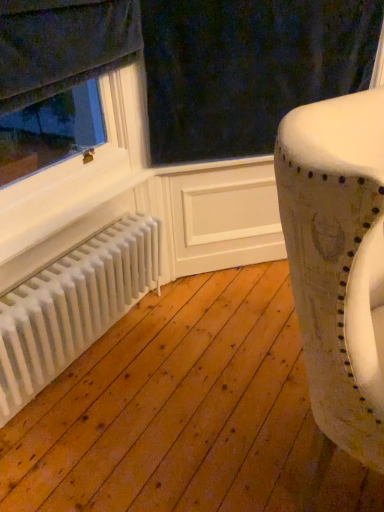
Describe the element at coordinates (73, 306) in the screenshot. I see `white matte radiator at lower left` at that location.

The width and height of the screenshot is (384, 512). What are the coordinates of `white matte radiator at lower left` in the screenshot? It's located at (73, 306).

What do you see at coordinates (338, 260) in the screenshot? This screenshot has height=512, width=384. I see `distressed leather chair at right` at bounding box center [338, 260].

Locate an element on the screen. distressed leather chair at right is located at coordinates (338, 260).

The image size is (384, 512). I want to click on white matte radiator at lower left, so click(73, 306).

Between distressed leather chair at right and white matte radiator at lower left, which one appears on the right side from the viewer's perspective?

Positioned to the right is distressed leather chair at right.

Which object is more forward, distressed leather chair at right or white matte radiator at lower left?

distressed leather chair at right is in front.

Considering the points (373, 397) and (73, 274), which point is behind, point (373, 397) or point (73, 274)?

The point (73, 274) is farther from the camera.

From the image's perspective, is distressed leather chair at right on top of white matte radiator at lower left?

Indeed, from the image's perspective, distressed leather chair at right is shown above white matte radiator at lower left.

From a real-world perspective, which is physically below, distressed leather chair at right or white matte radiator at lower left?

white matte radiator at lower left, from a real-world perspective.

Between distressed leather chair at right and white matte radiator at lower left, which one has smaller width?

white matte radiator at lower left.

Between distressed leather chair at right and white matte radiator at lower left, which one has more height?

distressed leather chair at right.

Considering the relative sizes of distressed leather chair at right and white matte radiator at lower left in the image provided, is distressed leather chair at right smaller than white matte radiator at lower left?

No.

Can we say distressed leather chair at right lies outside white matte radiator at lower left?

Yes.

Is distressed leather chair at right next to white matte radiator at lower left?

No, distressed leather chair at right is not beside white matte radiator at lower left.

Is distressed leather chair at right facing away from white matte radiator at lower left?

Yes, distressed leather chair at right is facing away from white matte radiator at lower left.

How many degrees apart are the facing directions of distressed leather chair at right and white matte radiator at lower left?

There is a 0.135-degree angle between the facing directions of distressed leather chair at right and white matte radiator at lower left.

The height and width of the screenshot is (512, 384). Find the location of `radiator lying below the distressed leather chair at right (from the image's perspective)`. radiator lying below the distressed leather chair at right (from the image's perspective) is located at coordinates (73, 306).

Considering the positions of objects white matte radiator at lower left and distressed leather chair at right in the image provided, who is more to the right, white matte radiator at lower left or distressed leather chair at right?

distressed leather chair at right is more to the right.

Which object is further away from the camera taking this photo, white matte radiator at lower left or distressed leather chair at right?

white matte radiator at lower left is more distant.

Is point (31, 321) behind point (317, 247)?

Yes, it is.

From the image's perspective, is white matte radiator at lower left located above distressed leather chair at right?

No.

From a real-world perspective, who is located lower, white matte radiator at lower left or distressed leather chair at right?

white matte radiator at lower left, from a real-world perspective.

Which of these two, white matte radiator at lower left or distressed leather chair at right, is wider?

Wider between the two is distressed leather chair at right.

Can you confirm if white matte radiator at lower left is shorter than distressed leather chair at right?

Indeed, white matte radiator at lower left has a lesser height compared to distressed leather chair at right.

Considering the sizes of objects white matte radiator at lower left and distressed leather chair at right in the image provided, who is bigger, white matte radiator at lower left or distressed leather chair at right?

distressed leather chair at right.

Looking at this image, is distressed leather chair at right a part of white matte radiator at lower left?

Actually, distressed leather chair at right is outside white matte radiator at lower left.

Is white matte radiator at lower left far from distressed leather chair at right?

Actually, white matte radiator at lower left and distressed leather chair at right are a little close together.

Is white matte radiator at lower left facing away from distressed leather chair at right?

No, white matte radiator at lower left's orientation is not away from distressed leather chair at right.

In the scene shown: Measure the distance between white matte radiator at lower left and distressed leather chair at right.

34.59 inches.

Locate an element on the screen. The image size is (384, 512). furniture that is on the right side of white matte radiator at lower left is located at coordinates (338, 260).

You are a GUI agent. You are given a task and a screenshot of the screen. Output one action in this format:
    pyautogui.click(x=<x>, y=<y>)
    Task: Click on the radiator on the left of distressed leather chair at right
    Image resolution: width=384 pixels, height=512 pixels.
    Given the screenshot: What is the action you would take?
    pyautogui.click(x=73, y=306)

You are a GUI agent. You are given a task and a screenshot of the screen. Output one action in this format:
    pyautogui.click(x=<x>, y=<y>)
    Task: Click on the furniture in front of the white matte radiator at lower left
    
    Given the screenshot: What is the action you would take?
    pyautogui.click(x=338, y=260)